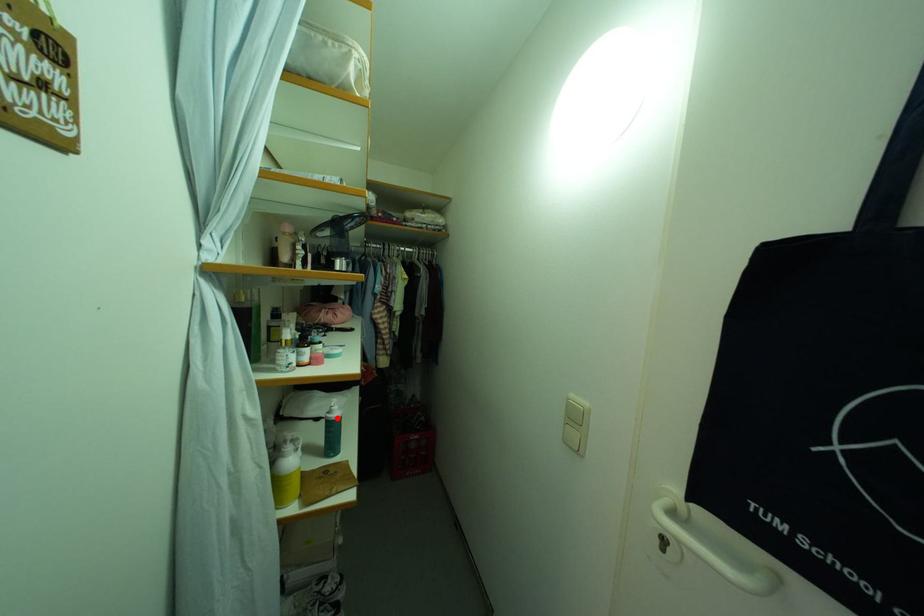
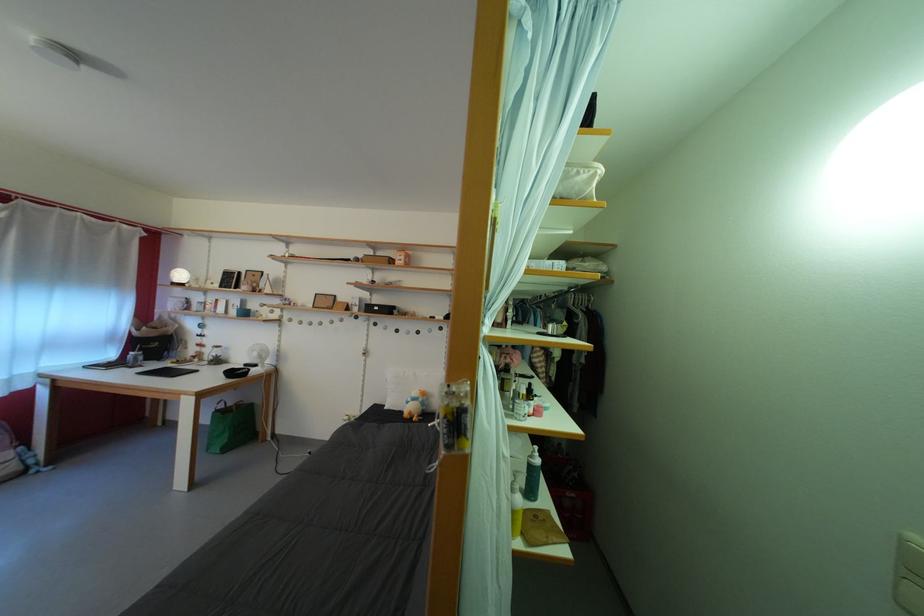
Question: I am providing you with two images of the same scene from different viewpoints. In image1, a red point is highlighted. Considering the same 3D point in image2, which of the following is correct?

Choices:
 (A) It is closer
 (B) It is farther

Answer: (B)